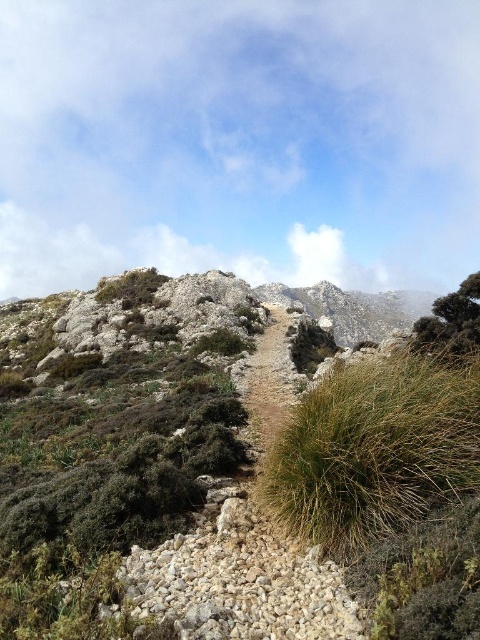
You are a hiker who wants to take a photo of the green leafy bush at upper right. You are currently standing on the green fibrous grass at center. Which direction should you move to get a better view of the bush?

The green fibrous grass at center is located below the green leafy bush at upper right, so you should move upwards or towards the upper right to get a better view of the bush.

You are a hiker who wants to place a 25 meter long tent between the green fibrous grass at center and the green leafy bush at upper right. Can you fit the tent between them?

The distance between the green fibrous grass at center and the green leafy bush at upper right is 24.29 meters. Since the tent is 25 meters long, it cannot be fully placed between them as there isn

You are a hiker navigating the rugged mountain path. You notice the green fibrous grass at center. Based on the coordinates provided, can you determine its position relative to the path?

The green fibrous grass at center is located at coordinates point (375, 449), which places it centrally along the path.